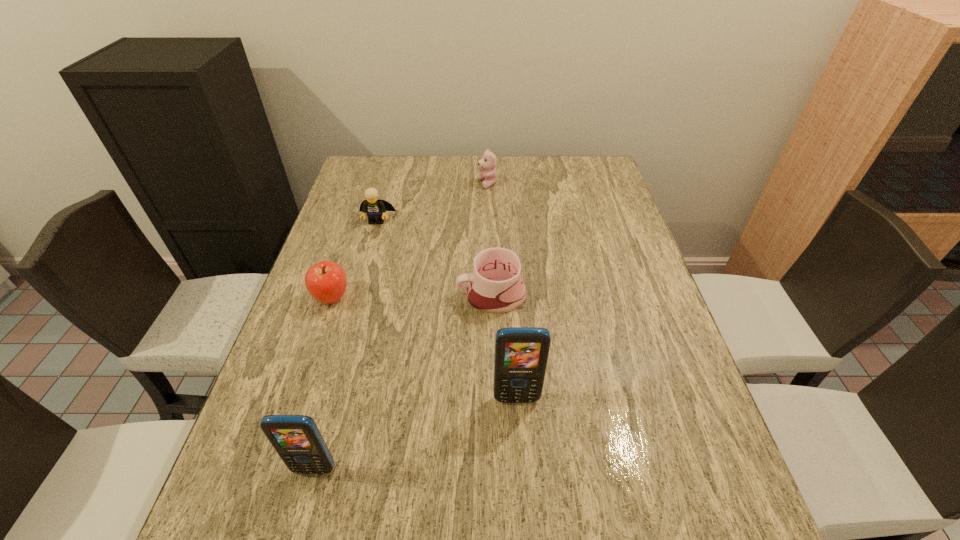
At what (x,y) coordinates should I click in order to perform the action: click on Lego that is at the left edge. Please return your answer as a coordinate pair (x, y). Image resolution: width=960 pixels, height=540 pixels. Looking at the image, I should click on (375, 209).

The width and height of the screenshot is (960, 540). What are the coordinates of `apple at the left edge` in the screenshot? It's located at (326, 281).

I want to click on object at the near left corner, so click(296, 438).

In the image, there is a desktop. Identify the location of vacant space at the far edge. The width and height of the screenshot is (960, 540). (455, 168).

You are a GUI agent. You are given a task and a screenshot of the screen. Output one action in this format:
    pyautogui.click(x=<x>, y=<y>)
    Task: Click on the free space at the near edge
    The image size is (960, 540).
    Given the screenshot: What is the action you would take?
    pyautogui.click(x=518, y=451)

At what (x,y) coordinates should I click in order to perform the action: click on vacant space at the left edge of the desktop. Please return your answer as a coordinate pair (x, y). Looking at the image, I should click on pos(361,211).

The image size is (960, 540). I want to click on vacant space at the right edge, so click(639, 399).

You are a GUI agent. You are given a task and a screenshot of the screen. Output one action in this format:
    pyautogui.click(x=<x>, y=<y>)
    Task: Click on the vacant area at the far left corner of the desktop
    The width and height of the screenshot is (960, 540).
    Given the screenshot: What is the action you would take?
    pyautogui.click(x=367, y=160)

Where is `free region at the far right corner of the desktop`? This screenshot has height=540, width=960. free region at the far right corner of the desktop is located at coordinates (575, 183).

The height and width of the screenshot is (540, 960). I want to click on free region at the near right corner of the desktop, so click(x=647, y=477).